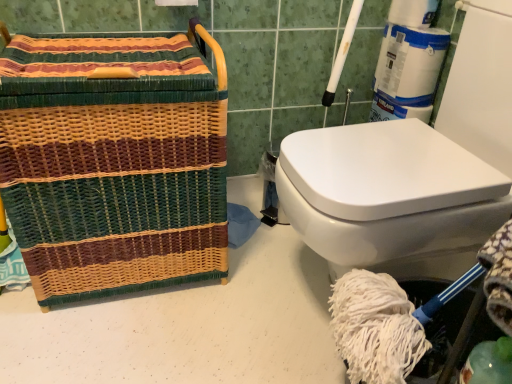
The width and height of the screenshot is (512, 384). Describe the element at coordinates (489, 363) in the screenshot. I see `teal glass at lower right` at that location.

Where is `teal glass at lower right`? teal glass at lower right is located at coordinates (489, 363).

Measure the distance between point (x=475, y=380) and camera.

Point (x=475, y=380) and camera are 24.25 inches apart from each other.

Image resolution: width=512 pixels, height=384 pixels. What do you see at coordinates (117, 172) in the screenshot?
I see `woven multicolored basket at left` at bounding box center [117, 172].

You are a GUI agent. You are given a task and a screenshot of the screen. Output one action in this format:
    pyautogui.click(x=<x>, y=<y>)
    Task: Click on the woven multicolored basket at left
    The image size is (512, 384).
    Given the screenshot: What is the action you would take?
    pyautogui.click(x=117, y=172)

What is the approximate width of woven multicolored basket at left?

woven multicolored basket at left is 17.93 inches in width.

You are a GUI agent. You are given a task and a screenshot of the screen. Output one action in this format:
    pyautogui.click(x=<x>, y=<y>)
    Task: Click on the teal glass at lower right
    This screenshot has height=384, width=512.
    Given the screenshot: What is the action you would take?
    coord(489,363)

Can you confirm if woven multicolored basket at left is positioned to the right of teal glass at lower right?

No.

Which object is further away from the camera taking this photo, woven multicolored basket at left or teal glass at lower right?

woven multicolored basket at left.

Is point (124, 223) less distant than point (484, 375)?

No, it is behind (484, 375).

From the image's perspective, which one is positioned higher, woven multicolored basket at left or teal glass at lower right?

woven multicolored basket at left.

From a real-world perspective, which is physically below, woven multicolored basket at left or teal glass at lower right?

teal glass at lower right is physically lower.

Between woven multicolored basket at left and teal glass at lower right, which one has smaller width?

teal glass at lower right is thinner.

Does woven multicolored basket at left have a greater height compared to teal glass at lower right?

Yes, woven multicolored basket at left is taller than teal glass at lower right.

Can you confirm if woven multicolored basket at left is smaller than teal glass at lower right?

No.

Can we say woven multicolored basket at left lies outside teal glass at lower right?

Absolutely, woven multicolored basket at left is external to teal glass at lower right.

Is woven multicolored basket at left directly adjacent to teal glass at lower right?

No, woven multicolored basket at left is not in contact with teal glass at lower right.

Is woven multicolored basket at left facing away from teal glass at lower right?

No, woven multicolored basket at left's orientation is not away from teal glass at lower right.

What's the angular difference between woven multicolored basket at left and teal glass at lower right's facing directions?

The angular difference between woven multicolored basket at left and teal glass at lower right is 90.3 degrees.

How much distance is there between woven multicolored basket at left and teal glass at lower right?

The distance of woven multicolored basket at left from teal glass at lower right is 31.34 inches.

Locate an element on the screen. The height and width of the screenshot is (384, 512). teal beneath the woven multicolored basket at left (from a real-world perspective) is located at coordinates (489, 363).

Which object is positioned more to the left, teal glass at lower right or woven multicolored basket at left?

woven multicolored basket at left is more to the left.

Is the depth of teal glass at lower right less than that of woven multicolored basket at left?

Yes, teal glass at lower right is closer to the camera.

Which is in front, point (501, 347) or point (207, 130)?

The point (501, 347) is more forward.

From the image's perspective, which object appears higher, teal glass at lower right or woven multicolored basket at left?

woven multicolored basket at left is shown above in the image.

From a real-world perspective, between teal glass at lower right and woven multicolored basket at left, who is vertically lower?

In real-world perspective, teal glass at lower right is lower.

Looking at this image, which object is wider, teal glass at lower right or woven multicolored basket at left?

Wider between the two is woven multicolored basket at left.

Considering the relative sizes of teal glass at lower right and woven multicolored basket at left in the image provided, is teal glass at lower right shorter than woven multicolored basket at left?

Correct, teal glass at lower right is not as tall as woven multicolored basket at left.

Considering the sizes of objects teal glass at lower right and woven multicolored basket at left in the image provided, who is bigger, teal glass at lower right or woven multicolored basket at left?

woven multicolored basket at left.

Looking at this image, is woven multicolored basket at left completely or partially inside teal glass at lower right?

No, woven multicolored basket at left is not inside teal glass at lower right.

Is teal glass at lower right touching woven multicolored basket at left?

No, teal glass at lower right is not in contact with woven multicolored basket at left.

Could you tell me if teal glass at lower right is turned towards woven multicolored basket at left?

No, teal glass at lower right is not turned towards woven multicolored basket at left.

What's the angular difference between teal glass at lower right and woven multicolored basket at left's facing directions?

The angle between the facing direction of teal glass at lower right and the facing direction of woven multicolored basket at left is 90.3 degrees.

You are a GUI agent. You are given a task and a screenshot of the screen. Output one action in this format:
    pyautogui.click(x=<x>, y=<y>)
    Task: Click on the basket that appears above the teal glass at lower right (from a real-world perspective)
    The image size is (512, 384).
    Given the screenshot: What is the action you would take?
    pyautogui.click(x=117, y=172)

The height and width of the screenshot is (384, 512). In order to click on basket above the teal glass at lower right (from the image's perspective) in this screenshot , I will do `click(117, 172)`.

Identify the location of basket to the left of teal glass at lower right. (117, 172).